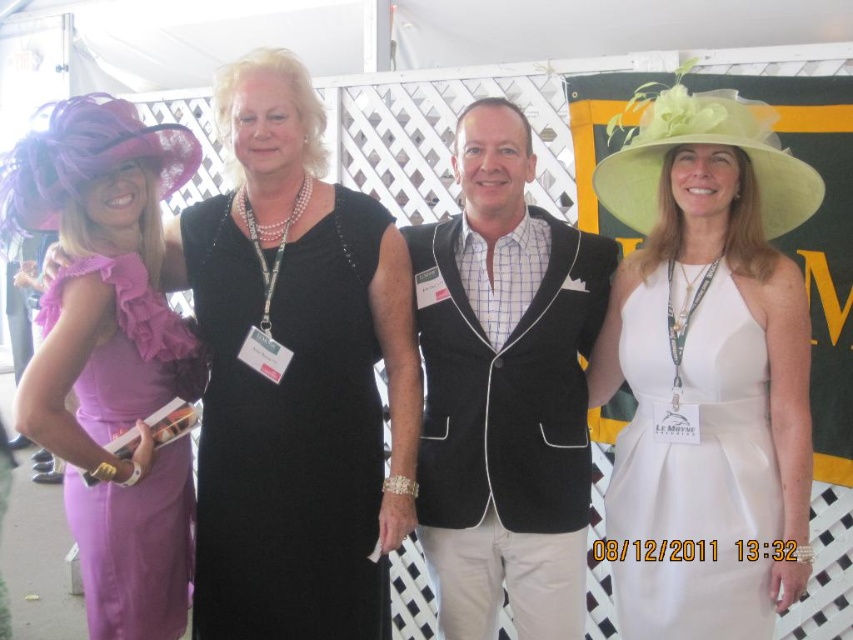
Is white satin dress at center thinner than ruffled satin dress at left?

No, white satin dress at center is not thinner than ruffled satin dress at left.

Consider the image. Is white satin dress at center further to camera compared to ruffled satin dress at left?

Yes, white satin dress at center is further from the viewer.

This screenshot has width=853, height=640. Find the location of `white satin dress at center`. white satin dress at center is located at coordinates (693, 461).

Between matte purple dress at left and ruffled satin dress at left, which one is positioned lower?

ruffled satin dress at left

Find the location of `matte purple dress at left`. matte purple dress at left is located at coordinates (294, 376).

Consider the image. Can you confirm if matte purple dress at left is positioned below white satin dress at center?

Incorrect, matte purple dress at left is not positioned below white satin dress at center.

The image size is (853, 640). What do you see at coordinates (294, 376) in the screenshot?
I see `matte purple dress at left` at bounding box center [294, 376].

Identify the location of matte purple dress at left. (294, 376).